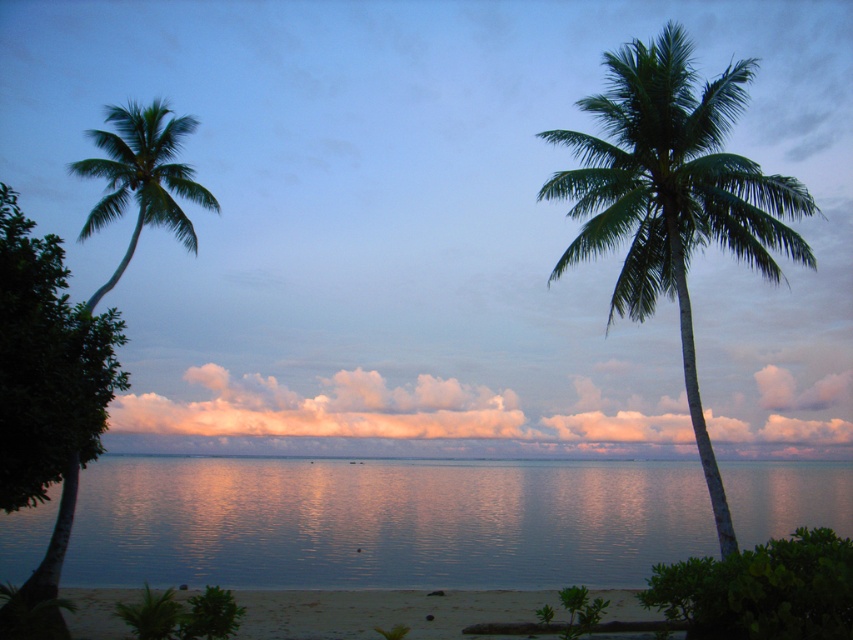
You are standing on the beach and want to take a photo of the smooth blue water at center and the green leafy palm tree at left. Which object will appear taller in the photo?

The green leafy palm tree at left will appear taller in the photo because it is taller than the smooth blue water at center.